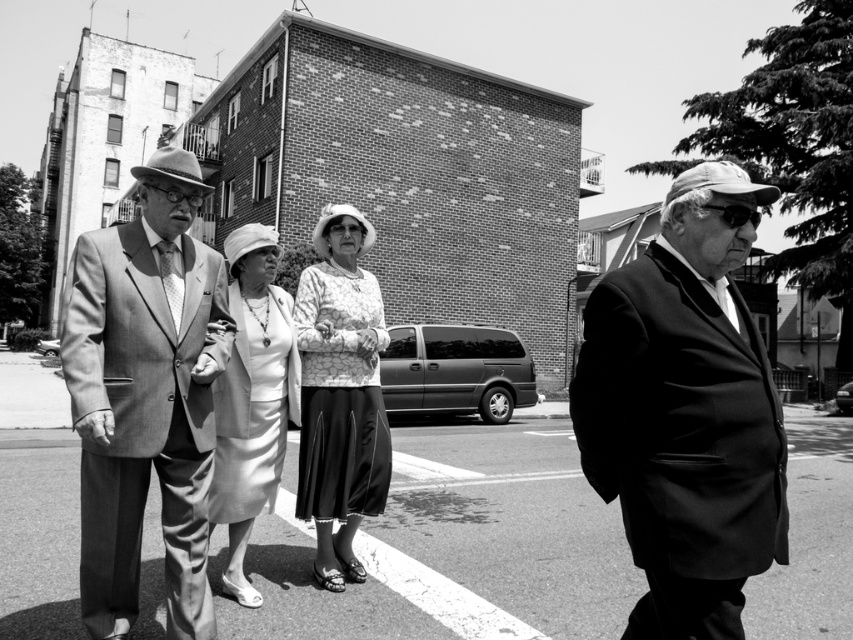
Question: Among these objects, which one is nearest to the camera?

Choices:
 (A) smooth gray suit at left
 (B) smooth black suit at center

Answer: (B)

Question: Considering the relative positions of patterned fabric dress at center and matte white dress at center in the image provided, where is patterned fabric dress at center located with respect to matte white dress at center?

Choices:
 (A) above
 (B) below

Answer: (A)

Question: Is patterned fabric dress at center to the right of matte white dress at center from the viewer's perspective?

Choices:
 (A) no
 (B) yes

Answer: (B)

Question: Which point is farther to the camera?

Choices:
 (A) [668, 204]
 (B) [241, 289]
 (C) [370, 376]
 (D) [134, 564]

Answer: (C)

Question: Among these points, which one is farthest from the camera?

Choices:
 (A) (708, 352)
 (B) (187, 248)
 (C) (293, 330)

Answer: (C)

Question: Does smooth gray suit at left have a lesser width compared to matte white dress at center?

Choices:
 (A) yes
 (B) no

Answer: (B)